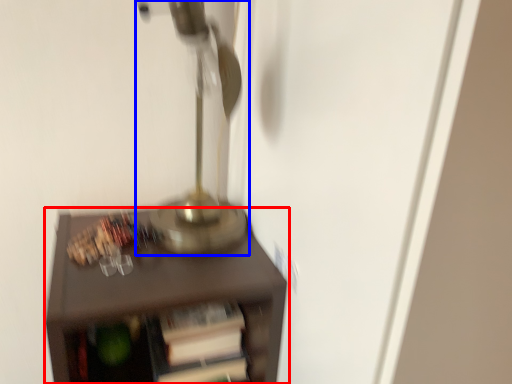
Question: Which of the following is the farthest to the observer, furniture (highlighted by a red box) or table lamp (highlighted by a blue box)?

Choices:
 (A) furniture
 (B) table lamp

Answer: (A)